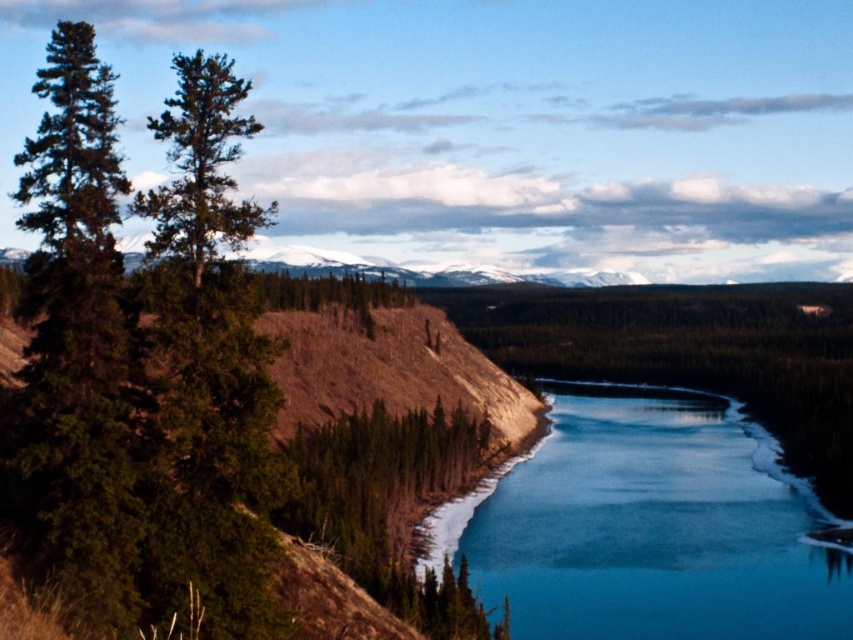
Question: From the image, what is the correct spatial relationship of blue ice at center in relation to green matte tree at upper left?

Choices:
 (A) left
 (B) right

Answer: (B)

Question: Among these objects, which one is farthest from the camera?

Choices:
 (A) green matte tree at upper left
 (B) blue ice at center

Answer: (B)

Question: Is blue ice at center wider than green matte tree at upper left?

Choices:
 (A) no
 (B) yes

Answer: (A)

Question: Is blue ice at center wider than green matte tree at upper left?

Choices:
 (A) yes
 (B) no

Answer: (B)